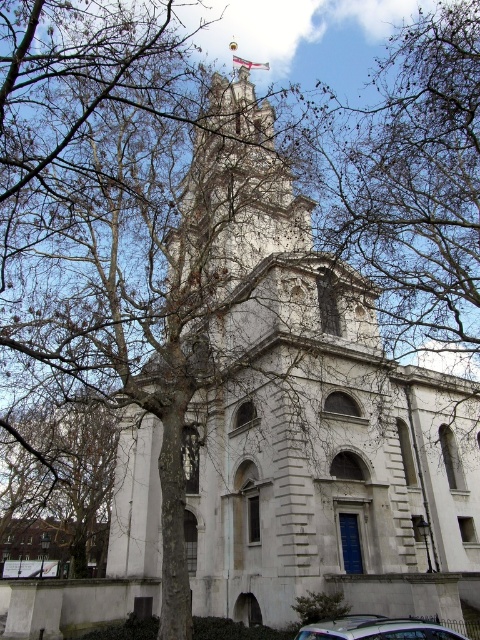
Question: Can you confirm if brown bark tree at left is positioned below metallic silver car at center?

Choices:
 (A) no
 (B) yes

Answer: (B)

Question: Which of the following is the farthest from the observer?

Choices:
 (A) metallic silver car at center
 (B) brown bark tree at left
 (C) white stone church at center

Answer: (B)

Question: Which object appears closest to the camera in this image?

Choices:
 (A) brown bark tree at left
 (B) white stone church at center
 (C) metallic silver car at center

Answer: (C)

Question: Among these objects, which one is farthest from the camera?

Choices:
 (A) white fabric flag at upper center
 (B) brown bark tree at left
 (C) white stone church at center

Answer: (A)

Question: Is brown bark tree at left further to camera compared to metallic silver car at center?

Choices:
 (A) yes
 (B) no

Answer: (A)

Question: Can you confirm if brown bark tree at left is positioned above white fabric flag at upper center?

Choices:
 (A) yes
 (B) no

Answer: (B)